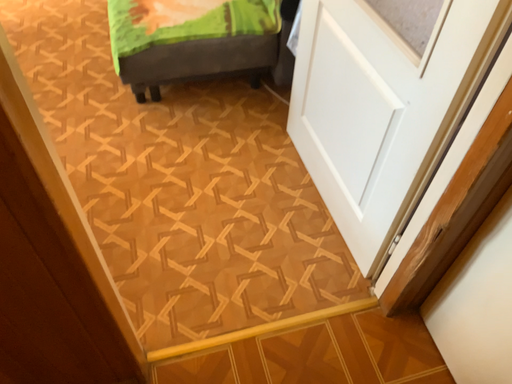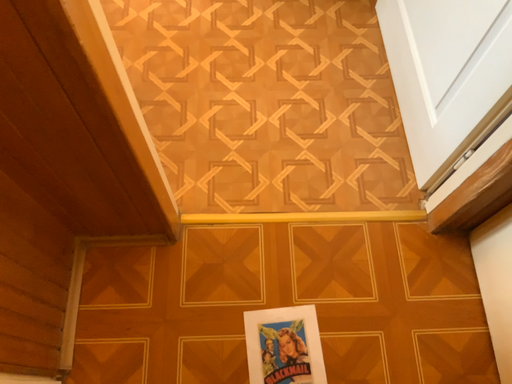
Question: How did the camera likely rotate when shooting the video?

Choices:
 (A) rotated upward
 (B) rotated downward

Answer: (B)